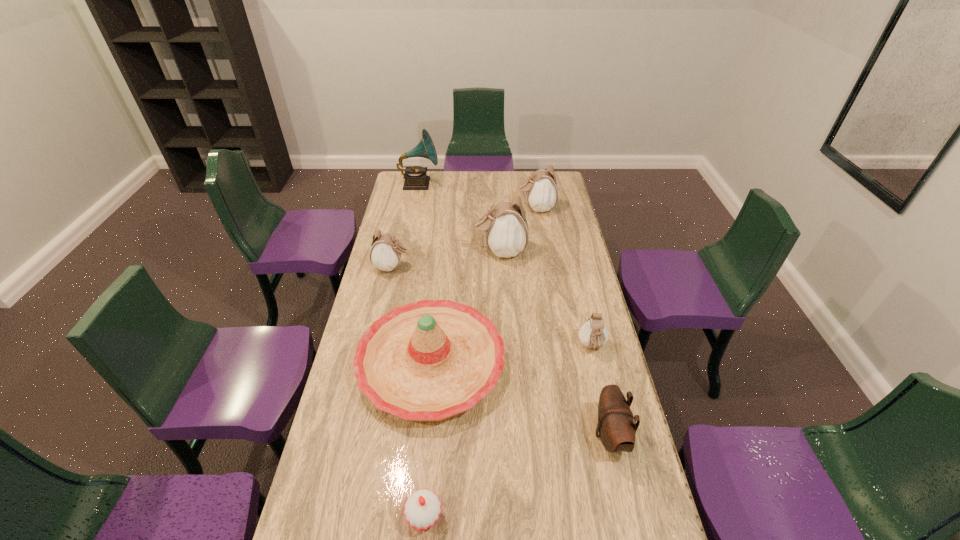
Identify the location of vacant space situated 0.310m on the front-facing side of the third biggest white pouch. This screenshot has height=540, width=960. (485, 267).

Where is `vacant space situated with the flap open on the nearest pouch`? The image size is (960, 540). vacant space situated with the flap open on the nearest pouch is located at coordinates tap(543, 435).

Identify the location of blank area located with the flap open on the nearest pouch. (465, 435).

Where is `free location located with the flap open on the nearest pouch`? free location located with the flap open on the nearest pouch is located at coordinates (462, 435).

Locate an element on the screen. The height and width of the screenshot is (540, 960). vacant space located 0.160m on the front-facing side of the seventh tallest object is located at coordinates (605, 402).

At what (x,y) coordinates should I click in order to perform the action: click on vacant space located on the right of the shortest object. Please return your answer as a coordinate pair (x, y). Looking at the image, I should click on (588, 517).

This screenshot has width=960, height=540. What are the coordinates of `object that is at the far edge` in the screenshot? It's located at (416, 178).

The width and height of the screenshot is (960, 540). I want to click on phonograph_record that is at the left edge, so click(416, 178).

This screenshot has width=960, height=540. In order to click on sombrero that is at the left edge in this screenshot , I will do `click(429, 360)`.

This screenshot has height=540, width=960. I want to click on pouch that is positioned at the left edge, so click(x=385, y=254).